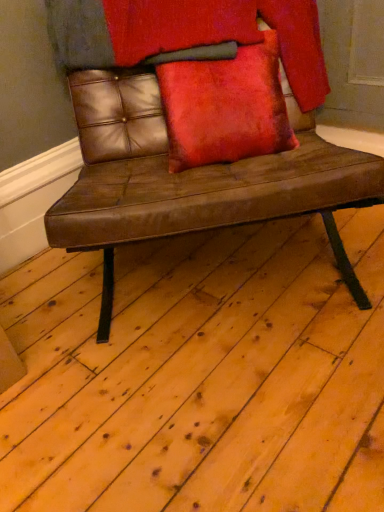
Describe the element at coordinates (225, 106) in the screenshot. Image resolution: width=384 pixels, height=512 pixels. I see `velvet red pillow at center` at that location.

Where is `velvet red pillow at center`? The image size is (384, 512). velvet red pillow at center is located at coordinates (225, 106).

Describe the element at coordinates (191, 180) in the screenshot. The image size is (384, 512). I see `brown leather bench at center` at that location.

Find the location of a particular element. The image size is (384, 512). brown leather bench at center is located at coordinates (191, 180).

Image resolution: width=384 pixels, height=512 pixels. Find the location of `velvet red pillow at center`. velvet red pillow at center is located at coordinates (225, 106).

Can you confirm if brown leather bench at center is positioned to the right of velvet red pillow at center?

No.

In the image, is brown leather bench at center positioned in front of or behind velvet red pillow at center?

In the image, brown leather bench at center appears in front of velvet red pillow at center.

In the scene shown: Which is closer to the camera, (164,206) or (265,37)?

Clearly, point (164,206) is closer to the camera than point (265,37).

From the image's perspective, does brown leather bench at center appear higher than velvet red pillow at center?

Incorrect, from the image's perspective, brown leather bench at center is lower than velvet red pillow at center.

From a real-world perspective, which is physically below, brown leather bench at center or velvet red pillow at center?

brown leather bench at center is physically lower.

Looking at this image, considering the sizes of brown leather bench at center and velvet red pillow at center in the image, is brown leather bench at center wider or thinner than velvet red pillow at center?

In the image, brown leather bench at center appears to be wider than velvet red pillow at center.

Can you confirm if brown leather bench at center is taller than velvet red pillow at center?

Correct, brown leather bench at center is much taller as velvet red pillow at center.

Based on their sizes in the image, would you say brown leather bench at center is bigger or smaller than velvet red pillow at center?

In the image, brown leather bench at center appears to be larger than velvet red pillow at center.

Is brown leather bench at center inside or outside of velvet red pillow at center?

brown leather bench at center is outside velvet red pillow at center.

Are brown leather bench at center and velvet red pillow at center located far from each other?

brown leather bench at center is actually quite close to velvet red pillow at center.

Consider the image. Could you tell me if brown leather bench at center is turned towards velvet red pillow at center?

Yes, brown leather bench at center faces towards velvet red pillow at center.

From the picture: Can you tell me how much brown leather bench at center and velvet red pillow at center differ in facing direction?

The angle between the facing direction of brown leather bench at center and the facing direction of velvet red pillow at center is 0.00151 degrees.

Image resolution: width=384 pixels, height=512 pixels. What are the coordinates of `chair in front of the velvet red pillow at center` in the screenshot? It's located at (191, 180).

Which is more to the right, velvet red pillow at center or brown leather bench at center?

Positioned to the right is velvet red pillow at center.

Considering their positions, is velvet red pillow at center located in front of or behind brown leather bench at center?

Visually, velvet red pillow at center is located behind brown leather bench at center.

Considering the positions of point (180, 115) and point (343, 184), is point (180, 115) closer or farther from the camera than point (343, 184)?

Clearly, point (180, 115) is more distant from the camera than point (343, 184).

From the image's perspective, is velvet red pillow at center on top of brown leather bench at center?

Correct, velvet red pillow at center appears higher than brown leather bench at center in the image.

From a real-world perspective, who is located higher, velvet red pillow at center or brown leather bench at center?

velvet red pillow at center.

Which of these two, velvet red pillow at center or brown leather bench at center, is thinner?

velvet red pillow at center.

Considering the sizes of objects velvet red pillow at center and brown leather bench at center in the image provided, who is taller, velvet red pillow at center or brown leather bench at center?

brown leather bench at center is taller.

In the scene shown: Considering the sizes of objects velvet red pillow at center and brown leather bench at center in the image provided, who is bigger, velvet red pillow at center or brown leather bench at center?

brown leather bench at center is bigger.

Is brown leather bench at center completely or partially inside velvet red pillow at center?

No, brown leather bench at center is located outside of velvet red pillow at center.

Based on the photo, is velvet red pillow at center not close to brown leather bench at center?

velvet red pillow at center is near brown leather bench at center, not far away.

Could you tell me if velvet red pillow at center is facing brown leather bench at center?

Yes, velvet red pillow at center is oriented towards brown leather bench at center.

How different are the orientations of velvet red pillow at center and brown leather bench at center in degrees?

0.00151 degrees.

You are a GUI agent. You are given a task and a screenshot of the screen. Output one action in this format:
    pyautogui.click(x=<x>, y=<y>)
    Task: Click on the pillow on the right of brown leather bench at center
    This screenshot has width=384, height=512.
    Given the screenshot: What is the action you would take?
    pyautogui.click(x=225, y=106)

Image resolution: width=384 pixels, height=512 pixels. Find the location of `chair below the velvet red pillow at center (from a real-world perspective)`. chair below the velvet red pillow at center (from a real-world perspective) is located at coordinates (191, 180).

Where is `pillow behind the brown leather bench at center`? pillow behind the brown leather bench at center is located at coordinates (225, 106).